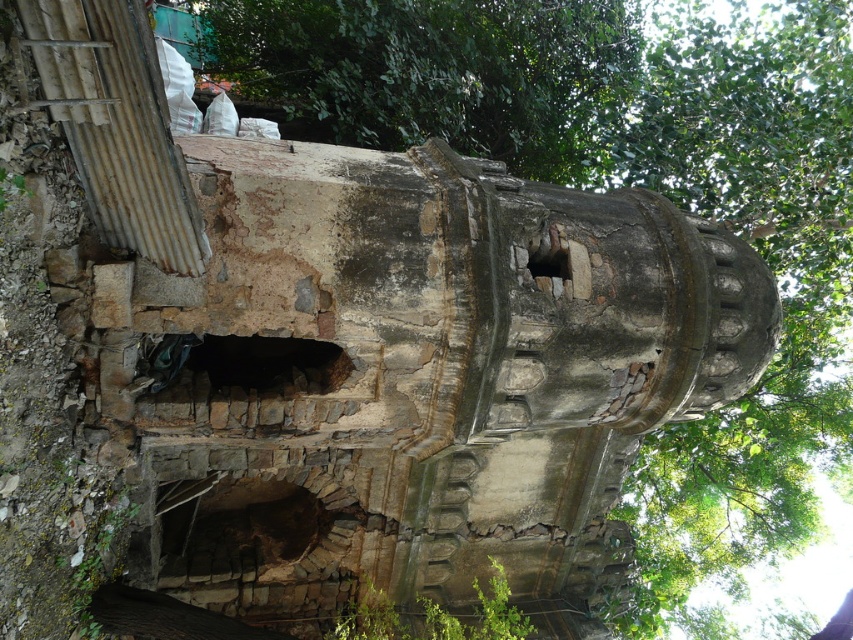
You are an archaeologist examining the mausoleum. You notice the brown stone hole at lower left and the rusty metal hole at center. Which hole is positioned lower in the structure?

The brown stone hole at lower left is positioned lower than the rusty metal hole at center.

You are an archaeologist examining the mausoleum. You notice the brown stone hole at lower left and the rusty metal hole at center. Which hole is closer to you as you stand in front of the mausoleum?

The brown stone hole at lower left is closer to you because the rusty metal hole at center is behind it.

You are an archaeologist examining the mausoleum and want to inspect both the brown stone hole at lower left and the dark stone hole at center. Which hole should you approach first to ensure safety, considering their positions relative to you?

You should approach the brown stone hole at lower left first because it is closer to you than the dark stone hole at center, making it safer to examine first.